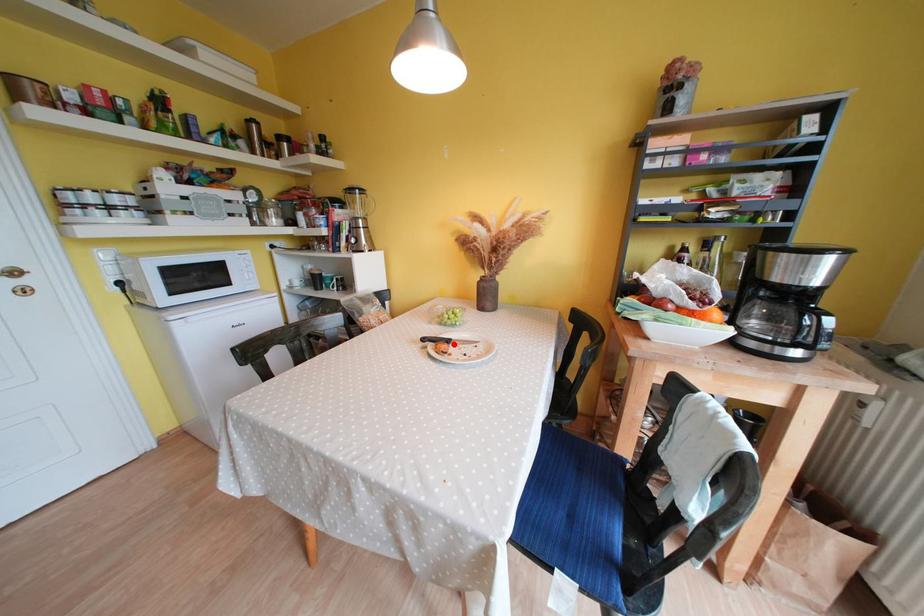
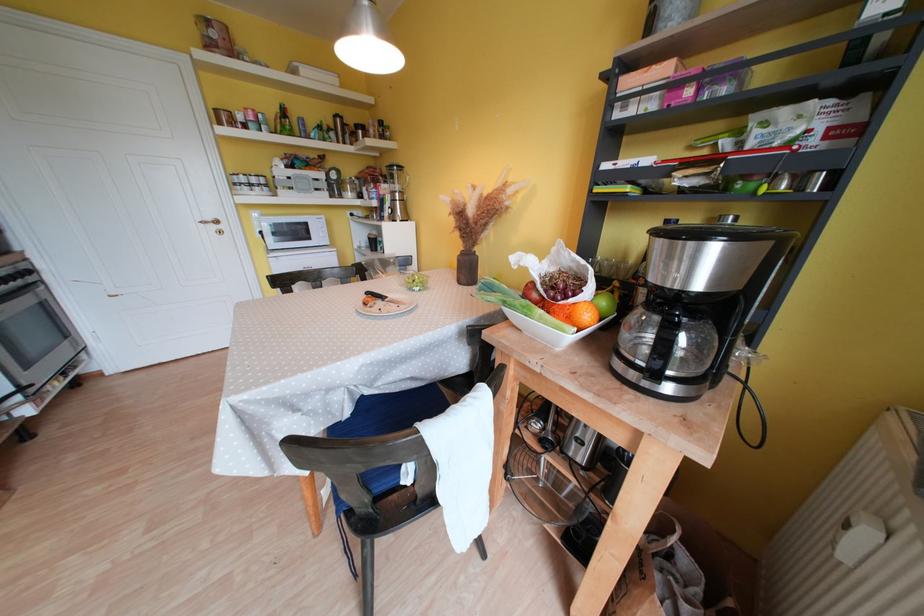
In the second image, find the point that corresponds to the highlighted location in the first image.

(390, 301)